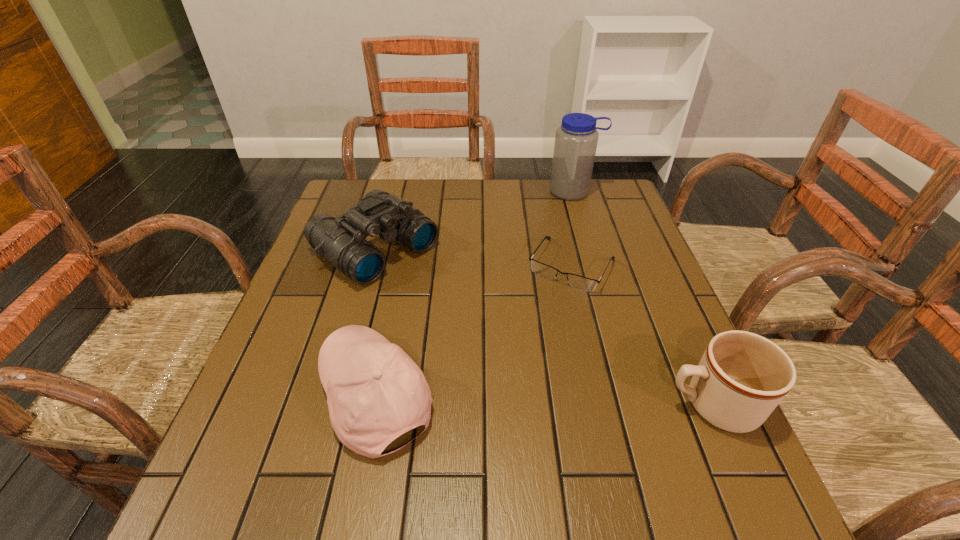
Where is `water bottle at the far edge`? water bottle at the far edge is located at coordinates (576, 139).

I want to click on baseball cap at the near edge, so click(375, 392).

Find the location of `mug that is at the near edge`. mug that is at the near edge is located at coordinates (741, 378).

Image resolution: width=960 pixels, height=540 pixels. Identify the location of baseball cap situated at the left edge. (375, 392).

Locate an element on the screen. This screenshot has width=960, height=540. binoculars that is at the left edge is located at coordinates (342, 241).

At what (x,y) coordinates should I click in order to perform the action: click on mug that is at the right edge. Please return your answer as a coordinate pair (x, y). The height and width of the screenshot is (540, 960). Looking at the image, I should click on (741, 378).

Identify the location of water bottle at the right edge. (576, 139).

I want to click on spectacles that is at the right edge, so 578,282.

The width and height of the screenshot is (960, 540). Find the location of `object that is at the far left corner`. object that is at the far left corner is located at coordinates pos(342,241).

Locate an element on the screen. The image size is (960, 540). object that is positioned at the near left corner is located at coordinates (375, 392).